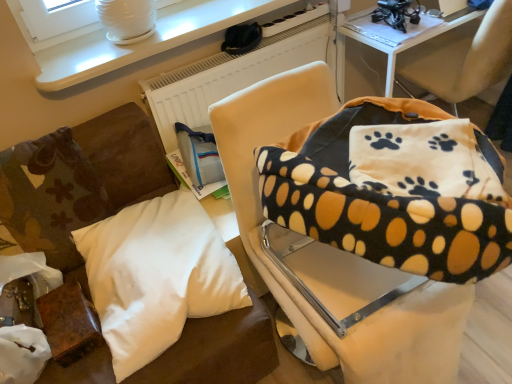
The width and height of the screenshot is (512, 384). Identify the location of vacant space situated above white matte radiator at upper center (from a real-world perspective). (267, 25).